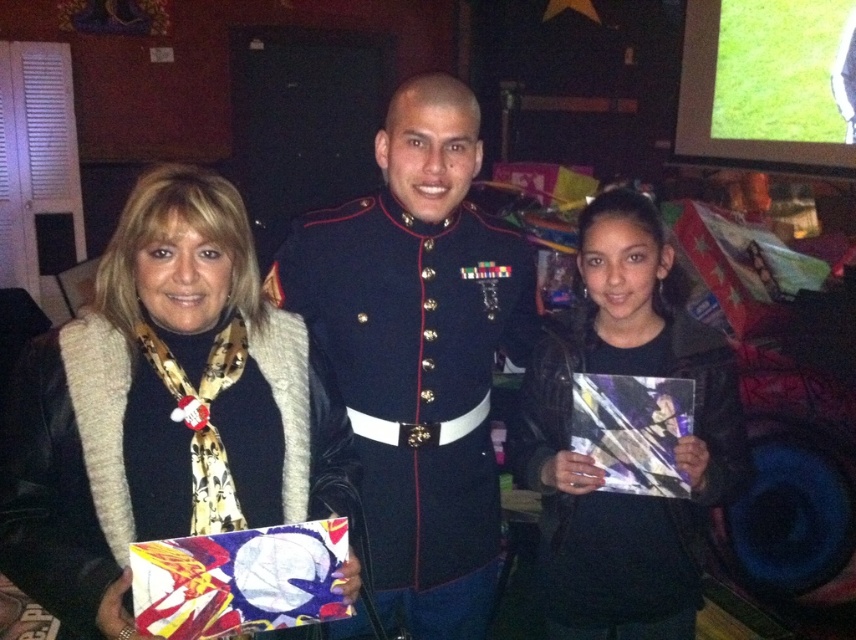
Question: Does navy blue fabric uniform at center have a greater width compared to black matte uniform at center?

Choices:
 (A) no
 (B) yes

Answer: (B)

Question: Can you confirm if matte black jacket at left is wider than black matte uniform at center?

Choices:
 (A) yes
 (B) no

Answer: (A)

Question: Which of the following is the closest to the observer?

Choices:
 (A) (736, 442)
 (B) (158, 264)

Answer: (B)

Question: In this image, where is matte black jacket at left located relative to navy blue fabric uniform at center?

Choices:
 (A) above
 (B) below

Answer: (A)

Question: Which point is closer to the camera taking this photo?

Choices:
 (A) (688, 589)
 (B) (378, 483)

Answer: (B)

Question: Which object is closer to the camera taking this photo?

Choices:
 (A) black matte uniform at center
 (B) matte black jacket at left
 (C) navy blue fabric uniform at center

Answer: (B)